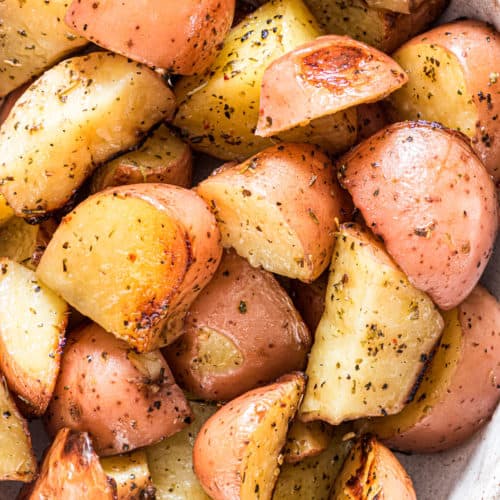
Locate an element on the screen. The height and width of the screenshot is (500, 500). bowl edge is located at coordinates (474, 483).